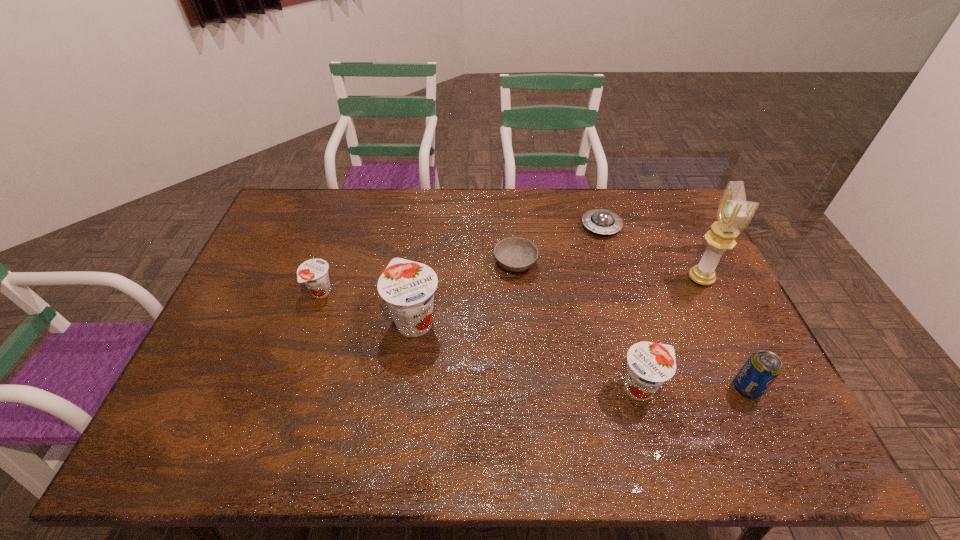
At what (x,y) coordinates should I click in order to perform the action: click on unoccupied position between the tallest object and the bowl. Please return your answer as a coordinate pair (x, y). Looking at the image, I should click on [x=608, y=271].

This screenshot has height=540, width=960. I want to click on vacant area that lies between the award and the second object from left to right, so click(x=558, y=299).

Find the location of a particular element. The image size is (960, 540). vacant area that lies between the second tallest yogurt and the soda is located at coordinates (694, 387).

Identify the location of blank region between the bowl and the second tallest yogurt. (578, 326).

The image size is (960, 540). Identify the location of unoccupied area between the soda and the third shortest object. (534, 340).

Locate an element on the screen. The width and height of the screenshot is (960, 540). free point between the farthest object and the soda is located at coordinates (674, 307).

Where is `unoccupied area between the award and the fifth object from right to left`? This screenshot has height=540, width=960. unoccupied area between the award and the fifth object from right to left is located at coordinates (608, 271).

Locate an element on the screen. This screenshot has height=540, width=960. empty space between the soda and the rightmost yogurt is located at coordinates (694, 387).

You are a GUI agent. You are given a task and a screenshot of the screen. Output one action in this format:
    pyautogui.click(x=<x>, y=<y>)
    Task: Click on the free space between the fifth tallest object and the tallest object
    The height and width of the screenshot is (540, 960).
    Given the screenshot: What is the action you would take?
    pyautogui.click(x=511, y=286)

I want to click on the closest object to the award, so click(x=601, y=221).